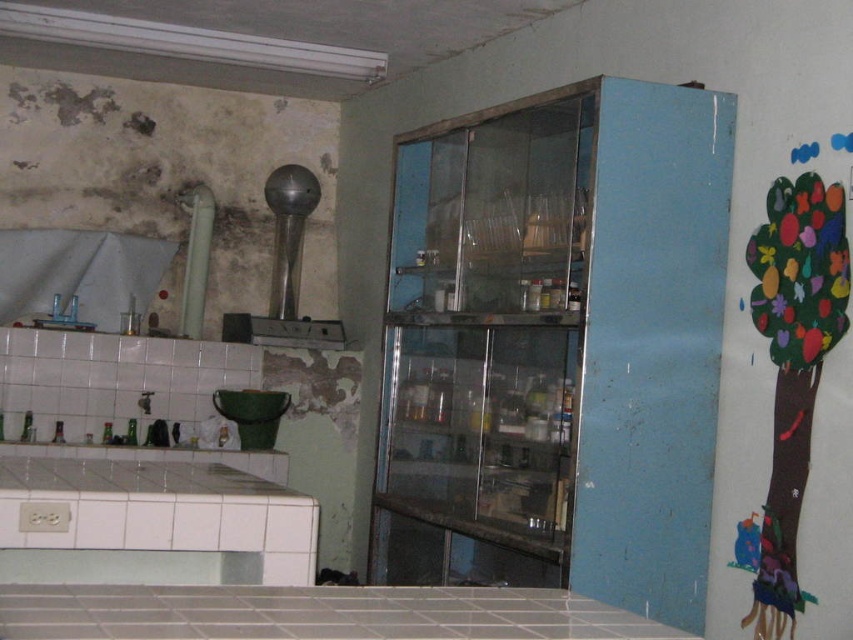
You are a person who is 1.7 meters tall standing in the kitchen. You want to reach the green bucket on the white tile counter at lower left. Can you comfortably reach it without standing on something?

The white tile counter at lower left is 1.90 meters away from the viewer. Since the distance is within a comfortable reaching range for a person of average height, you can likely reach the green bucket on the white tile counter at lower left without needing to stand on something.

You are standing in the kitchen and need to place a large pot on the counter. The white tile counter at lower left and the white tile counter at lower center are both options. Which counter is positioned to the left side of the other?

The white tile counter at lower left is to the left of the white tile counter at lower center.

You are standing in the kitchen and want to reach both the point at coordinates point (157, 465) and point (456, 602). Which point is closer to you?

The point at coordinates point (157, 465) is closer to you because it is further to the viewer than point (456, 602).